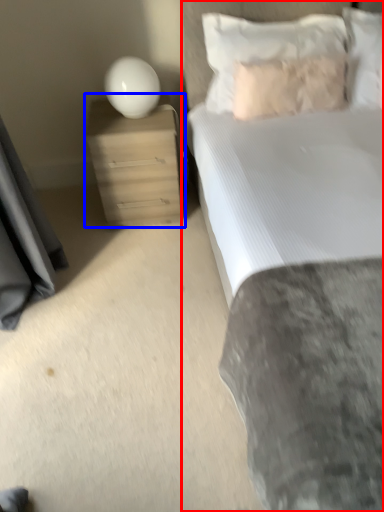
Question: Which of the following is the farthest to the observer, bed (highlighted by a red box) or nightstand (highlighted by a blue box)?

Choices:
 (A) bed
 (B) nightstand

Answer: (B)